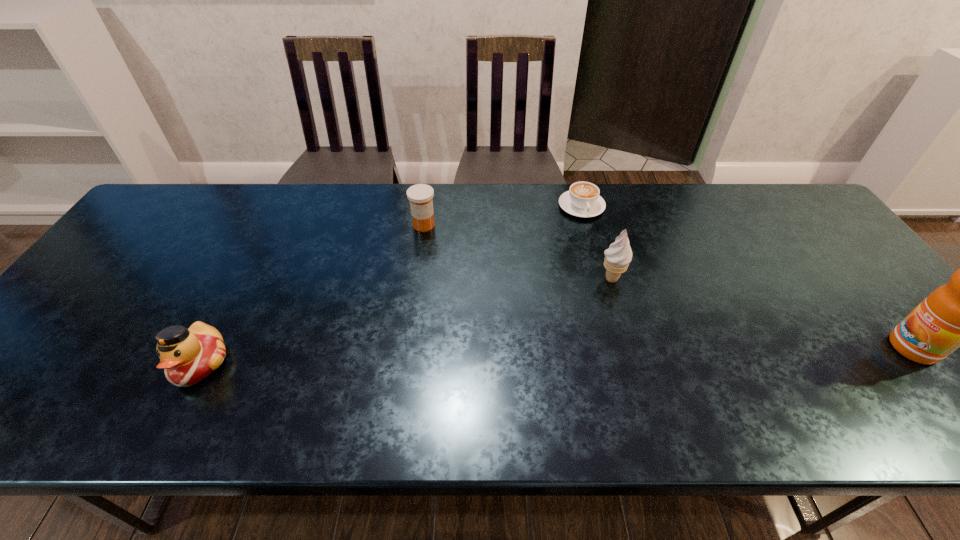
Locate an element on the screen. This screenshot has width=960, height=540. blank space at the near left corner of the desktop is located at coordinates (57, 366).

Locate an element on the screen. vacant space at the far right corner of the desktop is located at coordinates (784, 224).

Where is `vacant space at the near right corner of the desktop`? The height and width of the screenshot is (540, 960). vacant space at the near right corner of the desktop is located at coordinates (930, 372).

Identify the location of free space between the fruit juice and the shortest object. (747, 277).

Find the location of a particular element. empty location between the fruit juice and the cappuccino is located at coordinates (747, 277).

At what (x,y) coordinates should I click in order to perform the action: click on free space between the second object from left to right and the duck. Please return your answer as a coordinate pair (x, y). The width and height of the screenshot is (960, 540). Looking at the image, I should click on (312, 294).

Find the location of `vacant area that lies between the leftmost object and the tallest object`. vacant area that lies between the leftmost object and the tallest object is located at coordinates (557, 355).

Locate an element on the screen. The width and height of the screenshot is (960, 540). free space between the third nearest object and the shortest object is located at coordinates (596, 242).

Locate an element on the screen. This screenshot has height=540, width=960. vacant area that lies between the cappuccino and the second object from left to right is located at coordinates (503, 215).

Where is `empty space between the icecream and the fruit juice`? This screenshot has height=540, width=960. empty space between the icecream and the fruit juice is located at coordinates (762, 313).